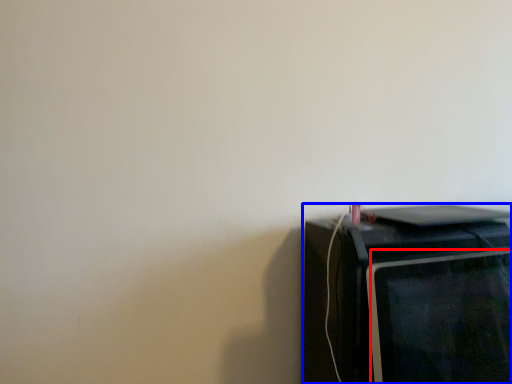
Question: Which object appears closest to the camera in this image, computer monitor (highlighted by a red box) or home appliance (highlighted by a blue box)?

Choices:
 (A) computer monitor
 (B) home appliance

Answer: (A)